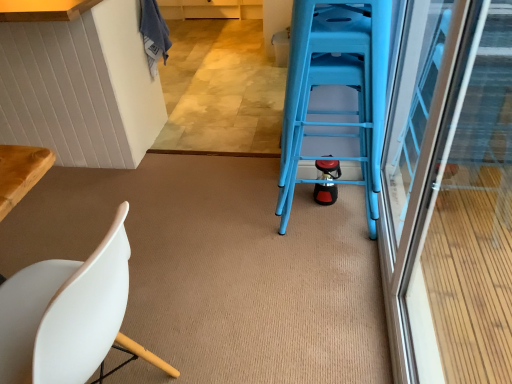
Question: Is white matte chair at lower left thinner than transparent glass screen door at right?

Choices:
 (A) yes
 (B) no

Answer: (B)

Question: Is white matte chair at lower left far from transparent glass screen door at right?

Choices:
 (A) no
 (B) yes

Answer: (B)

Question: Is transparent glass screen door at right located within white matte chair at lower left?

Choices:
 (A) yes
 (B) no

Answer: (B)

Question: From a real-world perspective, is white matte chair at lower left over transparent glass screen door at right?

Choices:
 (A) no
 (B) yes

Answer: (A)

Question: Can you confirm if white matte chair at lower left is wider than transparent glass screen door at right?

Choices:
 (A) yes
 (B) no

Answer: (A)

Question: Is white matte chair at lower left next to transparent glass screen door at right and touching it?

Choices:
 (A) yes
 (B) no

Answer: (B)

Question: From the image's perspective, does white matte chair at lower left appear lower than blue plastic ladder at center?

Choices:
 (A) no
 (B) yes

Answer: (B)

Question: Does white matte chair at lower left have a smaller size compared to blue plastic ladder at center?

Choices:
 (A) no
 (B) yes

Answer: (B)

Question: Can you confirm if white matte chair at lower left is bigger than blue plastic ladder at center?

Choices:
 (A) yes
 (B) no

Answer: (B)

Question: Does white matte chair at lower left have a greater width compared to blue plastic ladder at center?

Choices:
 (A) yes
 (B) no

Answer: (A)

Question: Is the surface of white matte chair at lower left in direct contact with blue plastic ladder at center?

Choices:
 (A) no
 (B) yes

Answer: (A)

Question: Is white matte chair at lower left facing towards blue plastic ladder at center?

Choices:
 (A) yes
 (B) no

Answer: (B)

Question: Does blue plastic ladder at center have a larger size compared to transparent glass screen door at right?

Choices:
 (A) no
 (B) yes

Answer: (A)